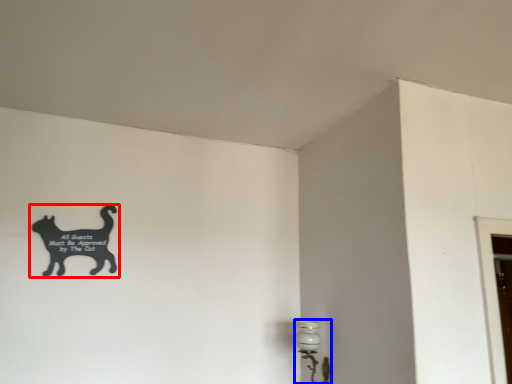
Question: Which point is closer to the camera, cat (highlighted by a red box) or lamp (highlighted by a blue box)?

Choices:
 (A) cat
 (B) lamp

Answer: (B)